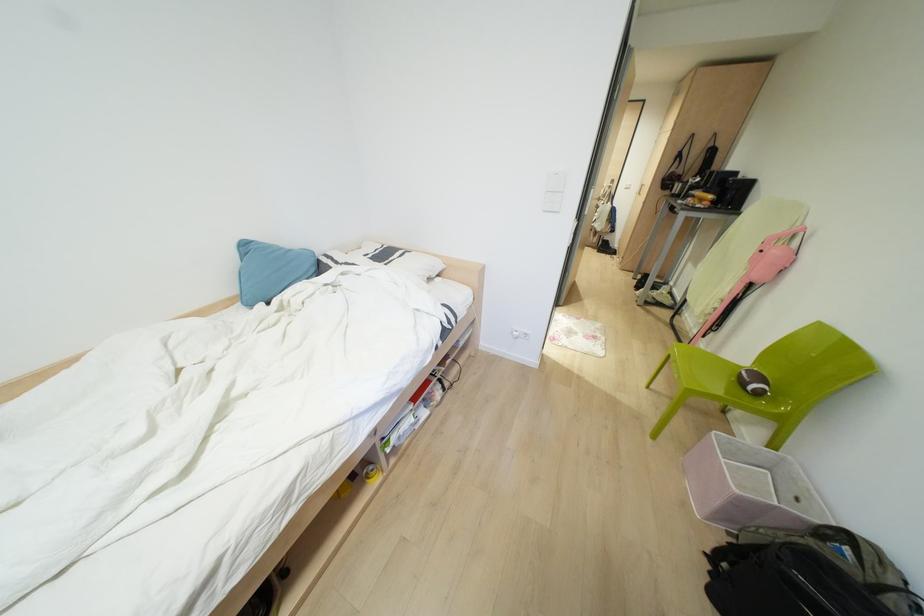
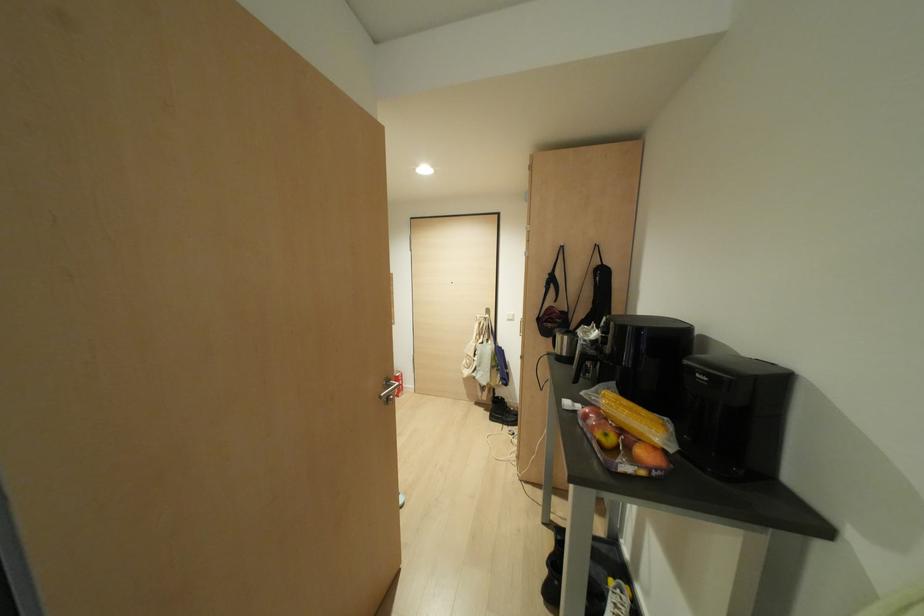
The point at (x=678, y=155) is marked in the first image. Where is the corresponding point in the second image?

(551, 280)